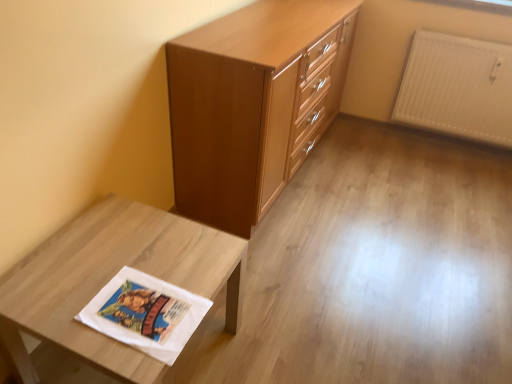
The width and height of the screenshot is (512, 384). Identify the location of vacant area that lies to the right of matte wood chest of drawers at center. (399, 184).